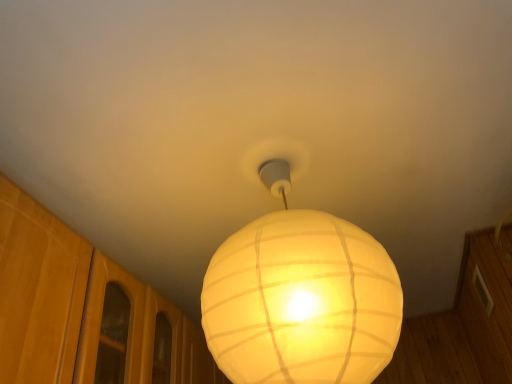
What do you see at coordinates (300, 298) in the screenshot? The height and width of the screenshot is (384, 512). I see `white ribbed lampshade at center` at bounding box center [300, 298].

Locate an element on the screen. white ribbed lampshade at center is located at coordinates (300, 298).

I want to click on white ribbed lampshade at center, so click(x=300, y=298).